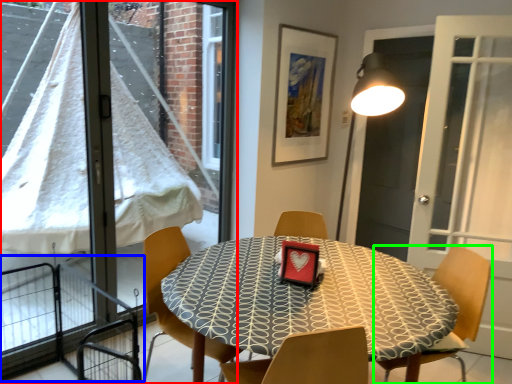
Question: Which is nearer to the window (highlighted by a red box)? balcony (highlighted by a blue box) or chair (highlighted by a green box).

Choices:
 (A) balcony
 (B) chair

Answer: (A)